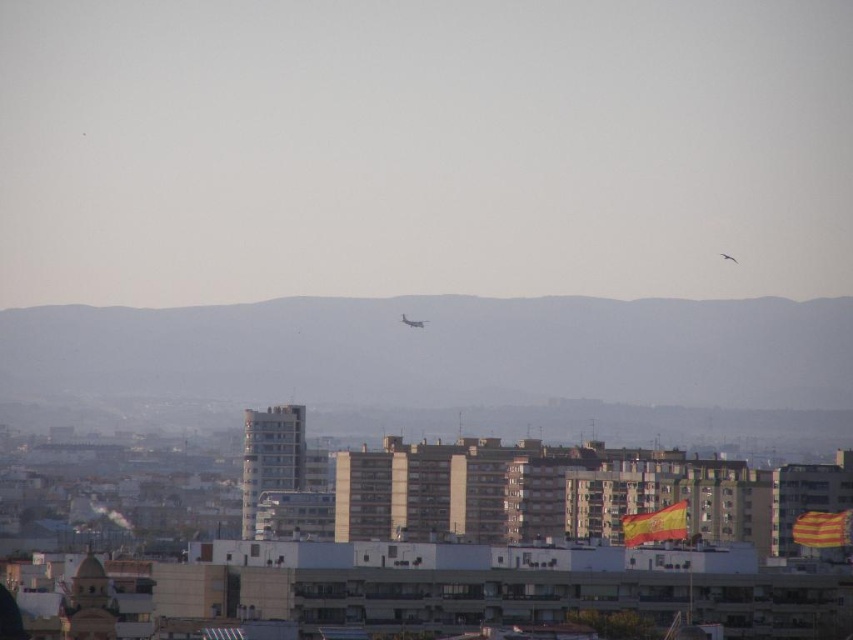
Which of these two, metallic silver airplane at center or metallic silver airplane at upper center, stands shorter?

metallic silver airplane at upper center

Which is below, metallic silver airplane at center or metallic silver airplane at upper center?

Positioned lower is metallic silver airplane at center.

What do you see at coordinates (412, 321) in the screenshot? This screenshot has height=640, width=853. I see `metallic silver airplane at center` at bounding box center [412, 321].

Identify the location of metallic silver airplane at center. This screenshot has height=640, width=853. (412, 321).